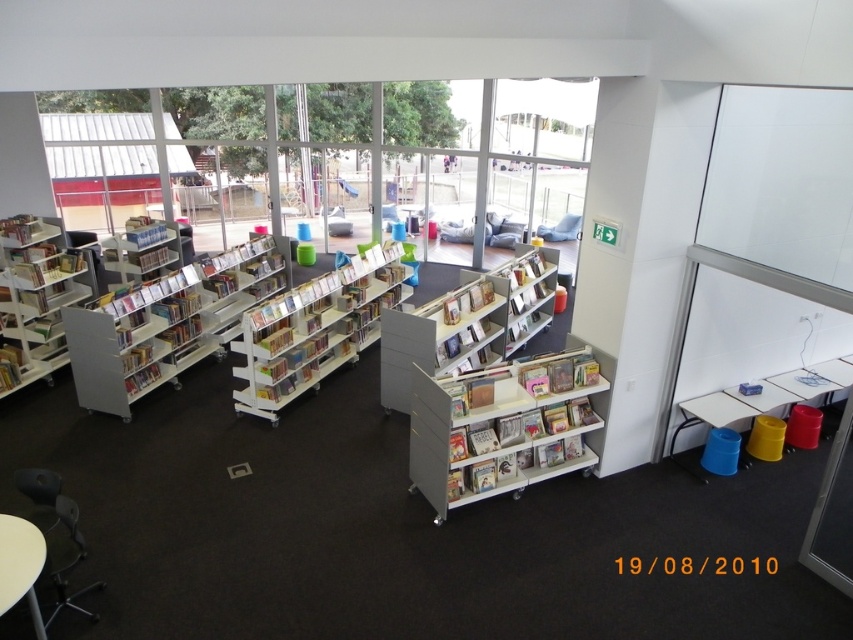
What are the coordinates of the transparent glass window at upper center in the image?

The transparent glass window at upper center is located at coordinates point (386, 163).

You are organizing a library event and need to place a large banner between the white plastic bookshelf at center and the matte plastic bookshelf at center. Based on their sizes, which bookshelf should the banner be placed closer to for better visibility?

The white plastic bookshelf at center has a larger size compared to the matte plastic bookshelf at center, so placing the banner closer to the white plastic bookshelf at center would provide better visibility due to its larger surface area.

You are standing in the library and want to look outside through the transparent glass window at upper center. Where should you move to see the point at coordinates point (386, 163)?

The point (386, 163) is on the transparent glass window at upper center, so you should move to the transparent glass window at upper center to see it.